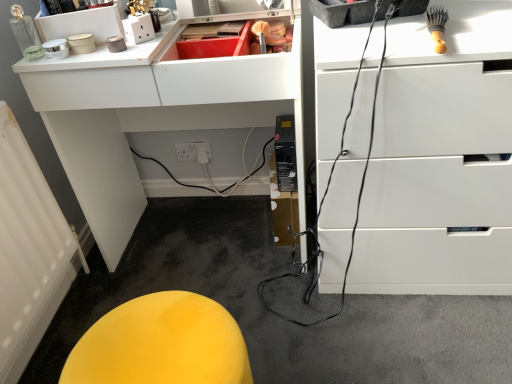
Find the location of a particular element. vacant point above yellow fabric stool at lower left (from a real-world perspective) is located at coordinates (162, 332).